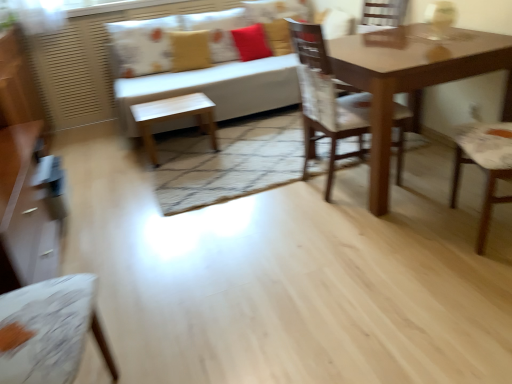
Question: Considering the relative sizes of white fabric couch at upper center and matte yellow pillow at upper center, which is the 2th pillow from right to left, in the image provided, is white fabric couch at upper center wider than matte yellow pillow at upper center, which is the 2th pillow from right to left,?

Choices:
 (A) no
 (B) yes

Answer: (B)

Question: Is white fabric couch at upper center far from matte yellow pillow at upper center, which is the 2th pillow from right to left?

Choices:
 (A) no
 (B) yes

Answer: (A)

Question: Can you confirm if white fabric couch at upper center is bigger than matte yellow pillow at upper center, which is the 2th pillow from right to left?

Choices:
 (A) yes
 (B) no

Answer: (A)

Question: From a real-world perspective, is white fabric couch at upper center located higher than matte yellow pillow at upper center, arranged as the second pillow when viewed from the left?

Choices:
 (A) yes
 (B) no

Answer: (B)

Question: Can you confirm if white fabric couch at upper center is positioned to the left of matte yellow pillow at upper center, which is the 2th pillow from right to left?

Choices:
 (A) no
 (B) yes

Answer: (A)

Question: Considering the positions of printed fabric pillow at upper center, arranged as the 1th pillow when viewed from the left, and white fabric couch at upper center in the image, is printed fabric pillow at upper center, arranged as the 1th pillow when viewed from the left, wider or thinner than white fabric couch at upper center?

Choices:
 (A) wide
 (B) thin

Answer: (B)

Question: From the image's perspective, is printed fabric pillow at upper center, which is counted as the third pillow, starting from the right, above or below white fabric couch at upper center?

Choices:
 (A) above
 (B) below

Answer: (A)

Question: Does point (140, 51) appear closer or farther from the camera than point (294, 81)?

Choices:
 (A) farther
 (B) closer

Answer: (A)

Question: From a real-world perspective, is printed fabric pillow at upper center, which is counted as the third pillow, starting from the right, above or below white fabric couch at upper center?

Choices:
 (A) below
 (B) above

Answer: (B)

Question: Considering their positions, is matte brown table at center located in front of or behind white fabric couch at upper center?

Choices:
 (A) front
 (B) behind

Answer: (A)

Question: Is point (376, 109) closer or farther from the camera than point (203, 84)?

Choices:
 (A) farther
 (B) closer

Answer: (B)

Question: From the image's perspective, is matte brown table at center above or below white fabric couch at upper center?

Choices:
 (A) below
 (B) above

Answer: (A)

Question: Considering the relative positions of matte brown table at center and white fabric couch at upper center in the image provided, is matte brown table at center to the left or to the right of white fabric couch at upper center?

Choices:
 (A) right
 (B) left

Answer: (A)

Question: From their relative heights in the image, would you say matte brown table at center is taller or shorter than printed fabric pillow at upper center, arranged as the 1th pillow when viewed from the left?

Choices:
 (A) tall
 (B) short

Answer: (A)

Question: Is point (368, 54) closer or farther from the camera than point (141, 34)?

Choices:
 (A) closer
 (B) farther

Answer: (A)